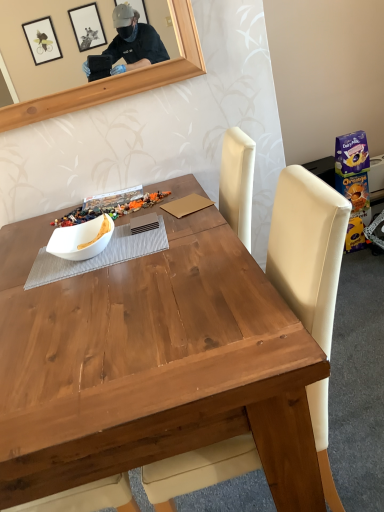
Find the location of `vacant area located to the right-hand side of white matte bowl at center`. vacant area located to the right-hand side of white matte bowl at center is located at coordinates (151, 239).